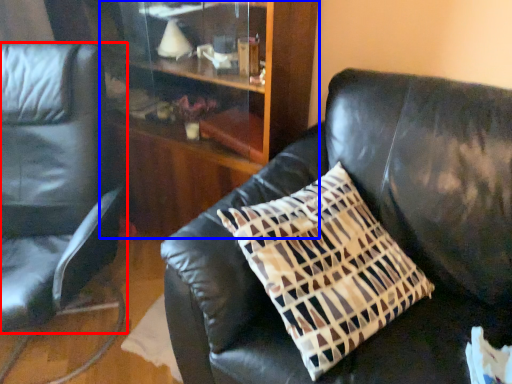
Question: Which of the following is the closest to the observer, chair (highlighted by a red box) or dresser (highlighted by a blue box)?

Choices:
 (A) chair
 (B) dresser

Answer: (A)